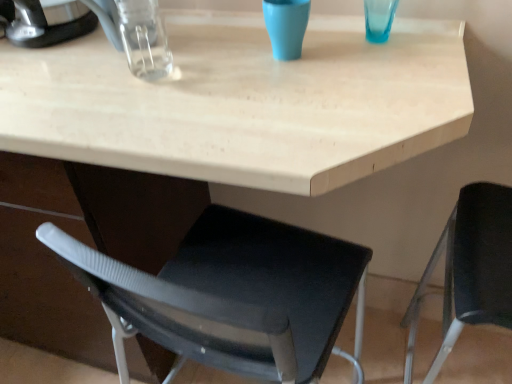
Question: Is black plastic chair at right far away from brushed metal coffee maker at upper left?

Choices:
 (A) yes
 (B) no

Answer: (B)

Question: Is black plastic chair at right oriented towards brushed metal coffee maker at upper left?

Choices:
 (A) no
 (B) yes

Answer: (B)

Question: Can brushed metal coffee maker at upper left be found inside black plastic chair at right?

Choices:
 (A) no
 (B) yes

Answer: (A)

Question: Can you confirm if black plastic chair at right is bigger than brushed metal coffee maker at upper left?

Choices:
 (A) yes
 (B) no

Answer: (A)

Question: Considering the relative sizes of black plastic chair at right and brushed metal coffee maker at upper left in the image provided, is black plastic chair at right smaller than brushed metal coffee maker at upper left?

Choices:
 (A) no
 (B) yes

Answer: (A)

Question: Is black plastic chair at right positioned behind brushed metal coffee maker at upper left?

Choices:
 (A) yes
 (B) no

Answer: (B)

Question: Can you confirm if black plastic chair at right is wider than matte blue cup at upper center?

Choices:
 (A) yes
 (B) no

Answer: (A)

Question: From a real-world perspective, is black plastic chair at right located higher than matte blue cup at upper center?

Choices:
 (A) yes
 (B) no

Answer: (B)

Question: Does black plastic chair at right have a smaller size compared to matte blue cup at upper center?

Choices:
 (A) yes
 (B) no

Answer: (B)

Question: Can you confirm if black plastic chair at right is positioned to the right of matte blue cup at upper center?

Choices:
 (A) yes
 (B) no

Answer: (A)

Question: Could matte blue cup at upper center be considered to be inside black plastic chair at right?

Choices:
 (A) no
 (B) yes

Answer: (A)

Question: Does black plastic chair at right turn towards matte blue cup at upper center?

Choices:
 (A) no
 (B) yes

Answer: (B)

Question: Is matte blue cup at upper center aimed at brushed metal coffee maker at upper left?

Choices:
 (A) no
 (B) yes

Answer: (A)